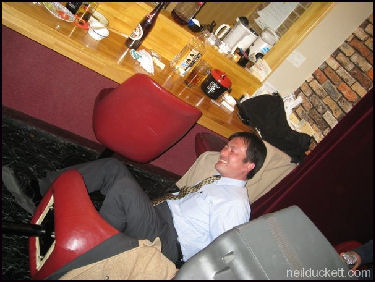
The width and height of the screenshot is (375, 282). I want to click on floor, so click(10, 211).